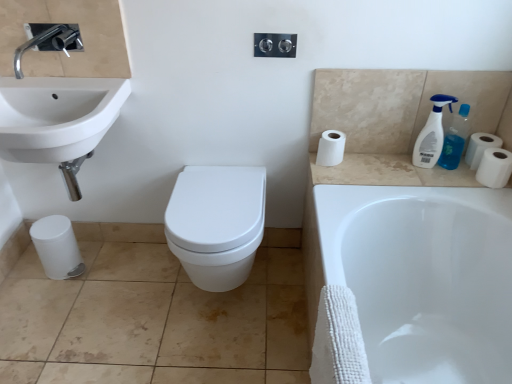
Find the location of a particular element. This screenshot has width=512, height=384. blank space above white marble countertop at upper right (from a real-world perspective) is located at coordinates (387, 167).